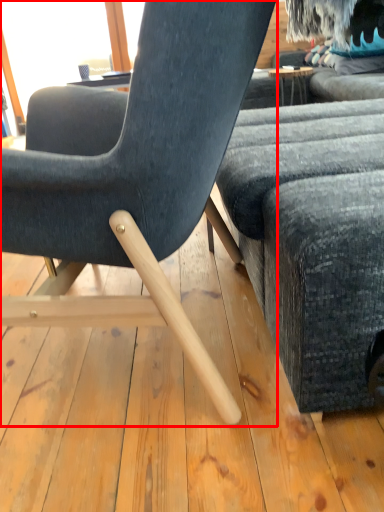
Question: Considering the relative positions of chair (annotated by the red box) and studio couch in the image provided, where is chair (annotated by the red box) located with respect to the staircase?

Choices:
 (A) right
 (B) left

Answer: (B)